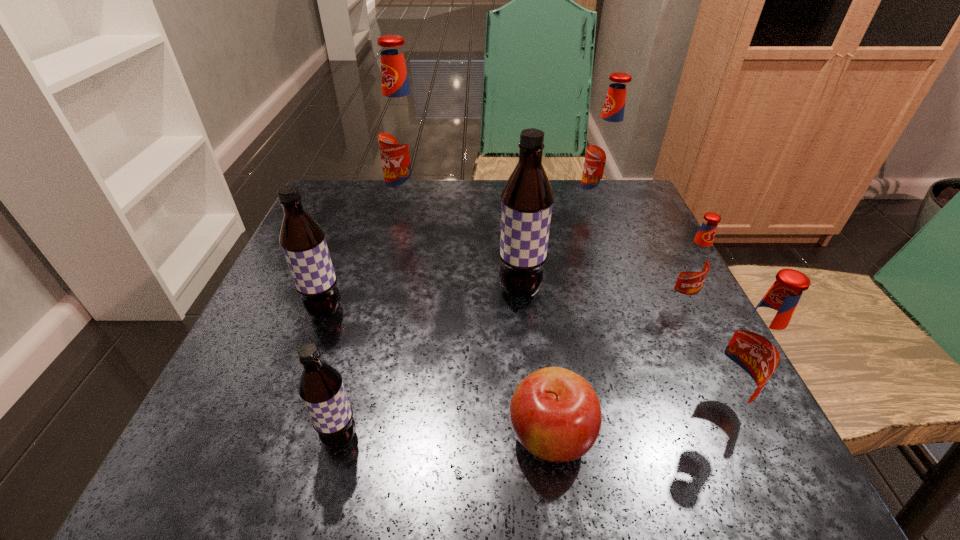
You are a GUI agent. You are given a task and a screenshot of the screen. Output one action in this format:
    pyautogui.click(x=<x>, y=<y>)
    Task: Click on the smallest brown root beer
    
    Given the screenshot: What is the action you would take?
    pyautogui.click(x=321, y=388)

Where is `the smallest red root beer`? This screenshot has height=540, width=960. the smallest red root beer is located at coordinates (695, 261).

At what (x,y) coordinates should I click in order to perform the action: click on apple. Please return your answer as a coordinate pair (x, y). This screenshot has height=540, width=960. Looking at the image, I should click on (555, 414).

Image resolution: width=960 pixels, height=540 pixels. I want to click on free space located 0.180m on the right of the tallest object, so click(x=509, y=207).

Locate an element on the screen. The image size is (960, 540). free space located 0.380m on the front of the third red root beer from right to left is located at coordinates (647, 355).

This screenshot has width=960, height=540. What are the coordinates of `vacant space located 0.230m on the left of the rightmost brown root beer` in the screenshot? It's located at (372, 290).

In order to click on free spot located 0.120m on the front of the leftmost brown root beer in this screenshot , I will do [298, 384].

Locate an element on the screen. vacant space located on the front of the third biggest red root beer is located at coordinates (754, 474).

Find the location of `free space located 0.090m on the right of the second brown root beer from right to left`. free space located 0.090m on the right of the second brown root beer from right to left is located at coordinates (426, 437).

This screenshot has width=960, height=540. I want to click on blank area located on the left of the smallest red root beer, so click(x=493, y=300).